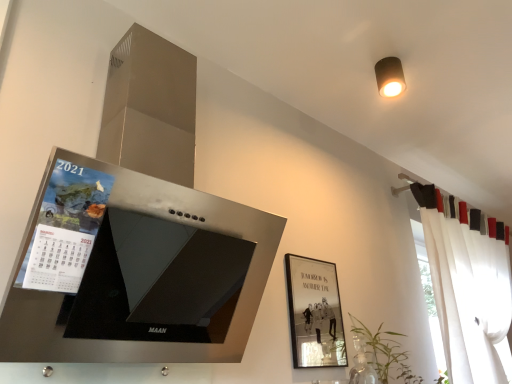
Question: Is green leafy plant at lower right oriented away from white sheer curtain at right?

Choices:
 (A) no
 (B) yes

Answer: (A)

Question: Considering the relative positions of green leafy plant at lower right and white sheer curtain at right in the image provided, is green leafy plant at lower right to the left of white sheer curtain at right from the viewer's perspective?

Choices:
 (A) no
 (B) yes

Answer: (B)

Question: From a real-world perspective, is green leafy plant at lower right positioned under white sheer curtain at right based on gravity?

Choices:
 (A) no
 (B) yes

Answer: (B)

Question: Is green leafy plant at lower right at the right side of white sheer curtain at right?

Choices:
 (A) yes
 (B) no

Answer: (B)

Question: From the image's perspective, is green leafy plant at lower right under white sheer curtain at right?

Choices:
 (A) yes
 (B) no

Answer: (A)

Question: Is green leafy plant at lower right thinner than white sheer curtain at right?

Choices:
 (A) no
 (B) yes

Answer: (B)

Question: Is matte brown cylindrical light fixture at upper right shorter than white sheer curtain at right?

Choices:
 (A) no
 (B) yes

Answer: (B)

Question: Is the depth of matte brown cylindrical light fixture at upper right less than that of white sheer curtain at right?

Choices:
 (A) yes
 (B) no

Answer: (A)

Question: Is white sheer curtain at right completely or partially inside matte brown cylindrical light fixture at upper right?

Choices:
 (A) no
 (B) yes

Answer: (A)

Question: Is matte brown cylindrical light fixture at upper right taller than white sheer curtain at right?

Choices:
 (A) no
 (B) yes

Answer: (A)

Question: Would you say matte brown cylindrical light fixture at upper right is outside white sheer curtain at right?

Choices:
 (A) no
 (B) yes

Answer: (B)

Question: Does matte brown cylindrical light fixture at upper right come behind white sheer curtain at right?

Choices:
 (A) no
 (B) yes

Answer: (A)

Question: From a real-world perspective, does green leafy plant at lower right sit lower than matte brown cylindrical light fixture at upper right?

Choices:
 (A) no
 (B) yes

Answer: (B)